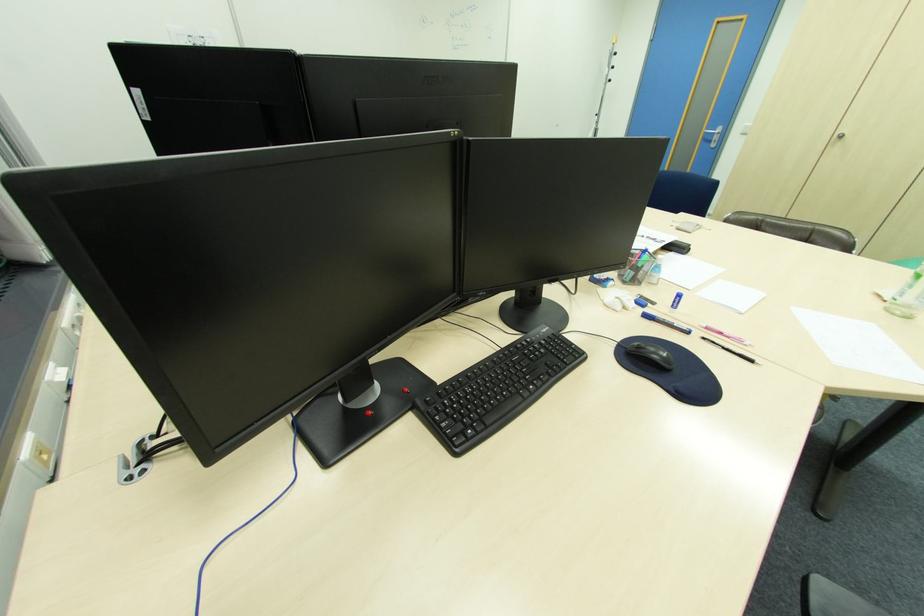
Find the location of a particular element. The image size is (924, 616). round cabinet handle is located at coordinates (840, 135).